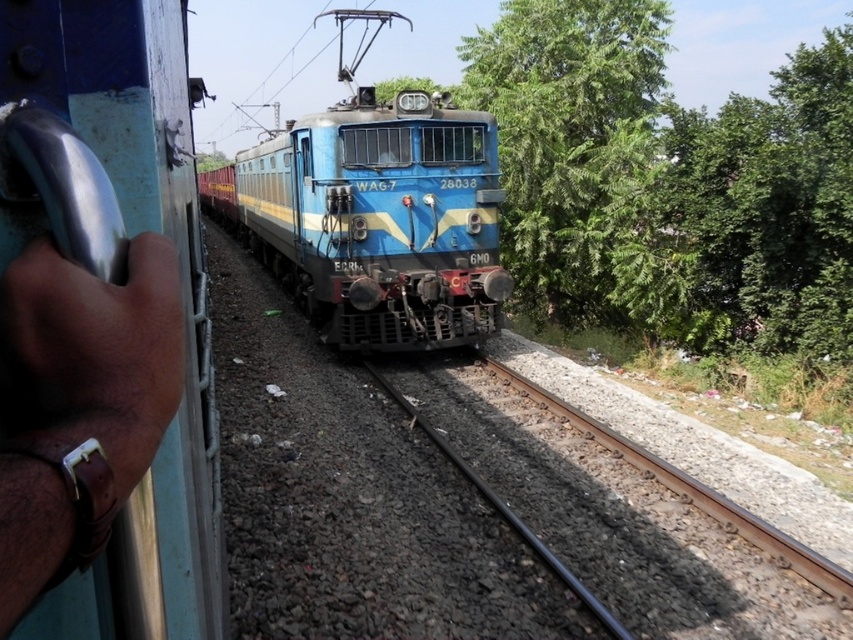
Question: Which object is farther from the camera taking this photo?

Choices:
 (A) brown leather wristwatch at left
 (B) blue glossy train at center
 (C) green leafy tree at center
 (D) black asphalt track at center

Answer: (C)

Question: Among these points, which one is farthest from the camera?

Choices:
 (A) (21, 401)
 (B) (817, 301)

Answer: (B)

Question: Is black asphalt track at center thinner than brown leather wristwatch at left?

Choices:
 (A) no
 (B) yes

Answer: (A)

Question: Does green leafy tree at center have a larger size compared to blue glossy train at center?

Choices:
 (A) no
 (B) yes

Answer: (B)

Question: Which object is closer to the camera taking this photo?

Choices:
 (A) black asphalt track at center
 (B) green leafy tree at center
 (C) brown leather wristwatch at left

Answer: (C)

Question: Can you confirm if green leafy tree at center is positioned above blue glossy train at center?

Choices:
 (A) no
 (B) yes

Answer: (B)